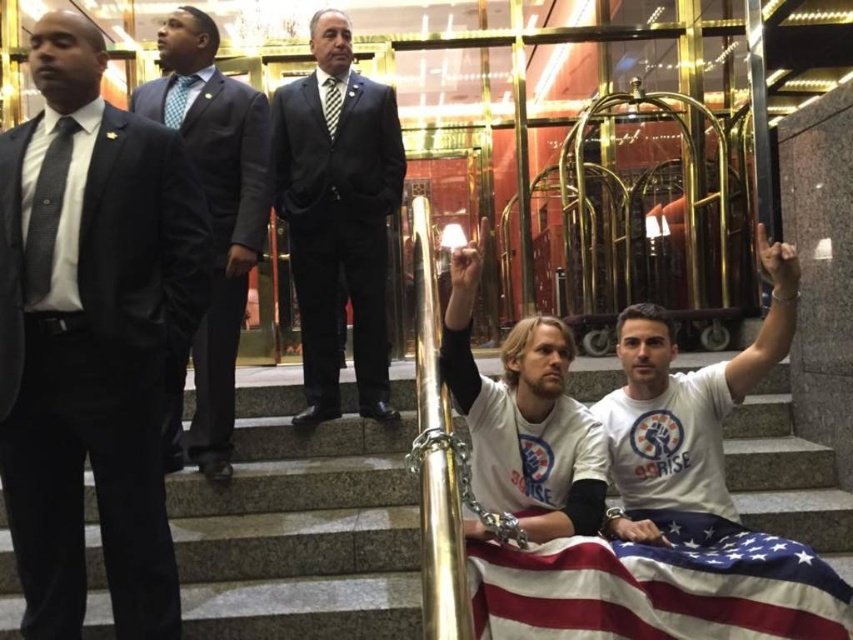
You are a security guard at the entrance. You notice the matte black suit at left and the american flag at lower center. Which object is positioned higher in the scene?

The matte black suit at left is above the american flag at lower center, so it is positioned higher in the scene.

Consider the image. You are standing at the entrance of the building and see two points marked in the scene. Which point is closer to you, point (97,209) or point (566,364)?

Point (97,209) is in front of point (566,364), so it is closer to you.